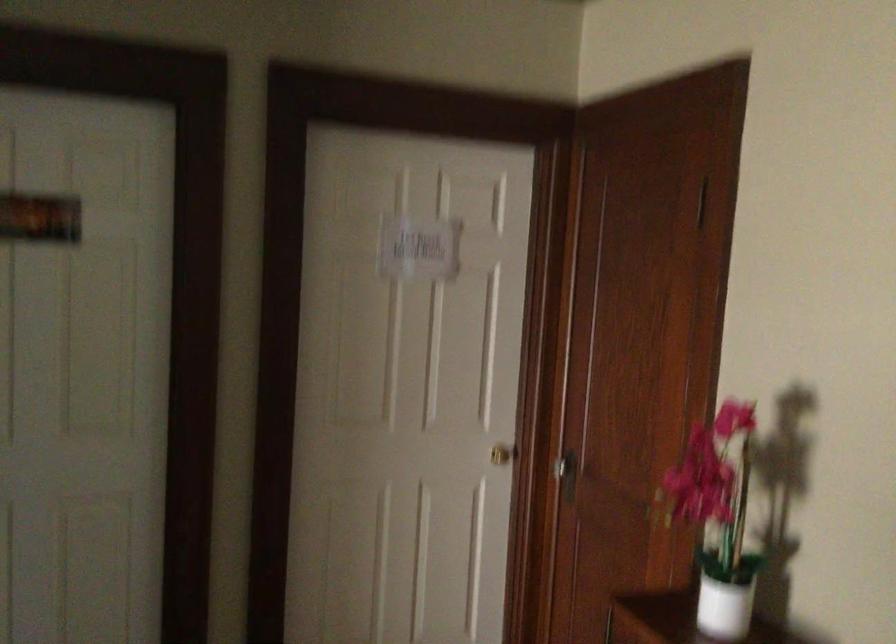
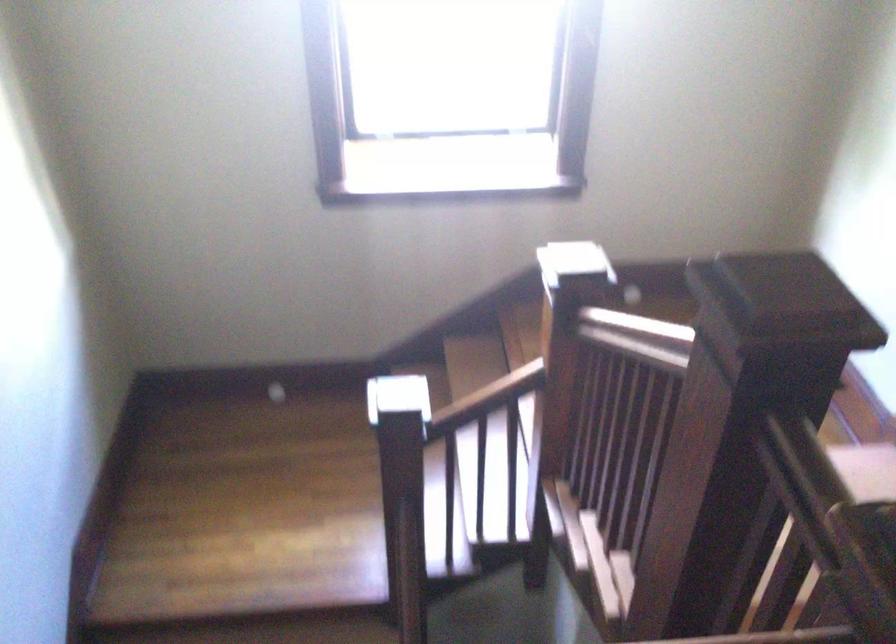
The first image is from the beginning of the video and the second image is from the end. How did the camera likely rotate when shooting the video?

The camera's rotation is toward left-down.